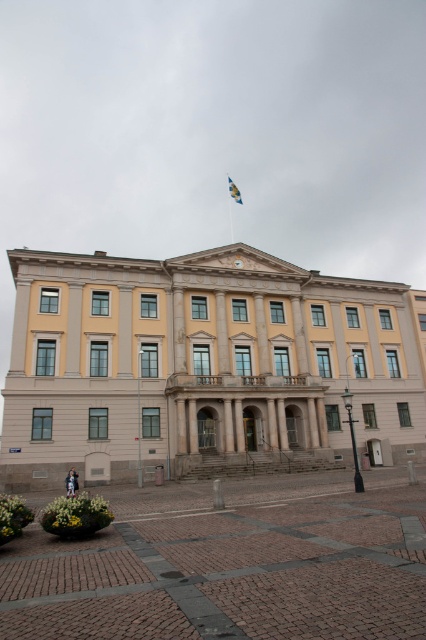
Question: Which of the following is the farthest from the observer?

Choices:
 (A) (181, 448)
 (B) (229, 182)
 (C) (23, 609)

Answer: (B)

Question: Which point is closer to the camera?

Choices:
 (A) (57, 621)
 (B) (238, 193)
 (C) (183, 420)

Answer: (A)

Question: Does yellow stone building at center have a smaller size compared to blue fabric flag at upper center?

Choices:
 (A) no
 (B) yes

Answer: (A)

Question: Which of the following is the farthest from the observer?

Choices:
 (A) (373, 291)
 (B) (316, 509)
 (C) (236, 188)

Answer: (C)

Question: Is yellow stone building at center to the right of brick paving at center from the viewer's perspective?

Choices:
 (A) no
 (B) yes

Answer: (B)

Question: Can you confirm if yellow stone building at center is bigger than blue fabric flag at upper center?

Choices:
 (A) no
 (B) yes

Answer: (B)